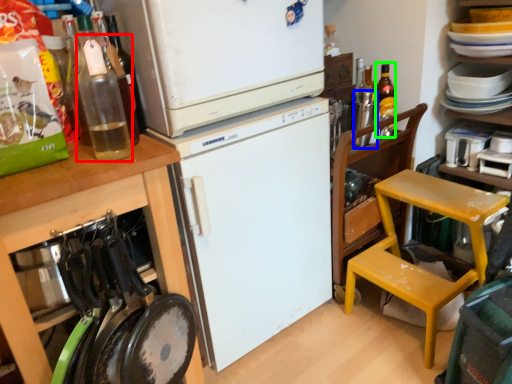
Question: Based on their relative distances, which object is nearer to bottle (highlighted by a red box)? Choose from bottle (highlighted by a blue box) and bottle (highlighted by a green box).

Choices:
 (A) bottle
 (B) bottle

Answer: (A)